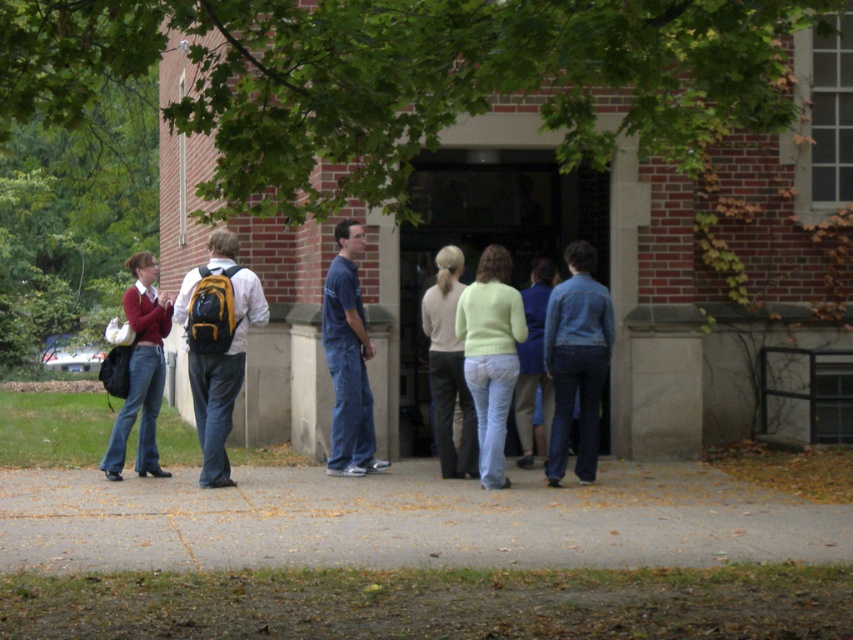
Which is more to the left, gray concrete pavement at lower center or light green sweater at center?

From the viewer's perspective, gray concrete pavement at lower center appears more on the left side.

Who is taller, gray concrete pavement at lower center or light green sweater at center?

Standing taller between the two is light green sweater at center.

Describe the element at coordinates (407, 520) in the screenshot. I see `gray concrete pavement at lower center` at that location.

This screenshot has height=640, width=853. I want to click on gray concrete pavement at lower center, so click(407, 520).

I want to click on green leafy tree at upper center, so click(x=405, y=80).

Is green leafy tree at upper center smaller than gray concrete pavement at lower center?

Yes.

Who is more distant from viewer, [436,58] or [555,541]?

Positioned behind is point [555,541].

You are a GUI agent. You are given a task and a screenshot of the screen. Output one action in this format:
    pyautogui.click(x=<x>, y=<y>)
    Task: Click on the green leafy tree at upper center
    This screenshot has height=640, width=853.
    Given the screenshot: What is the action you would take?
    pyautogui.click(x=405, y=80)

Between gray concrete pavement at lower center and matte black backpack at left, which one appears on the right side from the viewer's perspective?

From the viewer's perspective, gray concrete pavement at lower center appears more on the right side.

Is point (749, 529) more distant than point (125, 312)?

No, it is not.

This screenshot has height=640, width=853. Find the location of `gray concrete pavement at lower center`. gray concrete pavement at lower center is located at coordinates (407, 520).